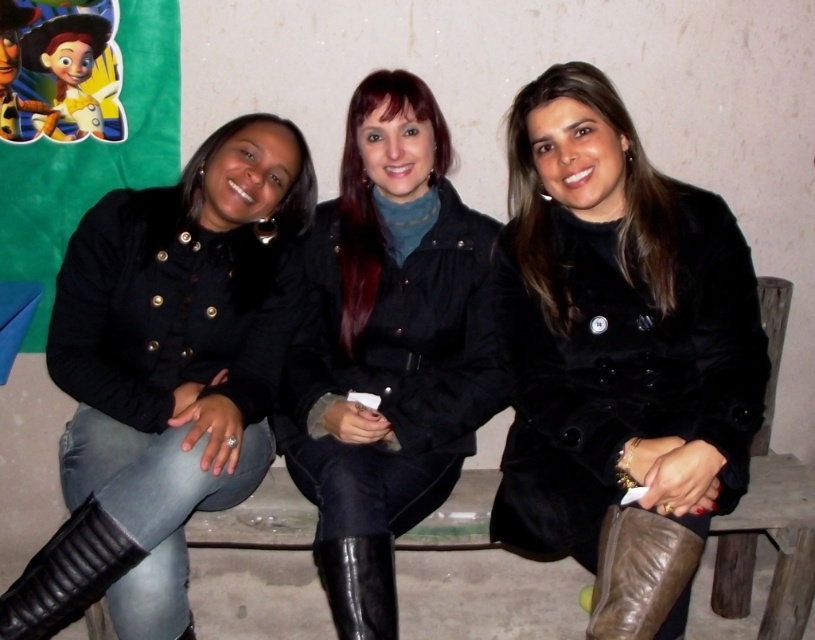
Question: Does black leather jacket at left have a greater width compared to black leather boot at lower center?

Choices:
 (A) no
 (B) yes

Answer: (B)

Question: Which point is farther to the camera?

Choices:
 (A) (337, 609)
 (B) (20, 604)
 (C) (565, 481)
 (D) (676, 528)

Answer: (C)

Question: Among these points, which one is nearest to the camera?

Choices:
 (A) (98, 467)
 (B) (576, 106)
 (C) (668, 532)

Answer: (C)

Question: Is black leather boot at lower left below black leather boot at lower center?

Choices:
 (A) no
 (B) yes

Answer: (A)

Question: In this image, where is leather boot at lower right located relative to black leather boot at lower center?

Choices:
 (A) right
 (B) left

Answer: (A)

Question: Which point appears farthest from the camera in this image?

Choices:
 (A) (342, 588)
 (B) (606, 552)
 (C) (333, 285)
 (D) (82, 288)

Answer: (C)